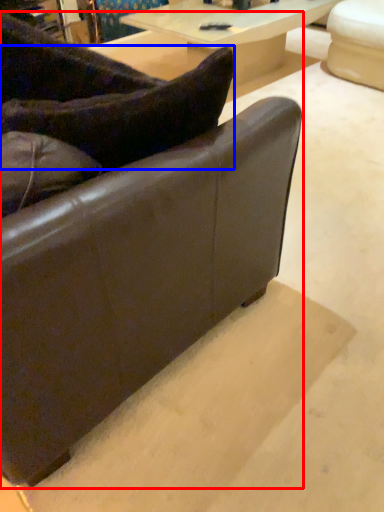
Question: Which of the following is the closest to the observer, studio couch (highlighted by a red box) or pillow (highlighted by a blue box)?

Choices:
 (A) studio couch
 (B) pillow

Answer: (A)